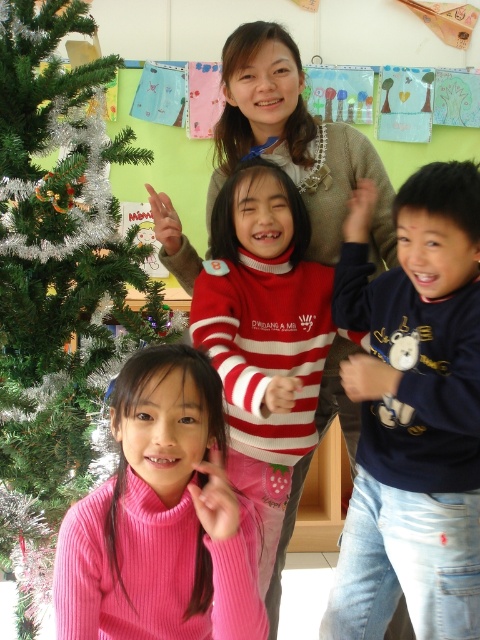
You are standing at the point labeled point (91,186) and want to move to the point labeled point (219,424). Which direction should you move to reach your destination?

To move from point (91,186) to point (219,424), you should move forward since point (91,186) is behind point (219,424).

You are a photographer setting up for a group photo in this scene. You need to ensure that both the green tinsel christmas tree at left and the pink ribbed sweater at center are clearly visible in the shot. Given their size difference, which object might require you to adjust your camera angle to avoid being too dominant in the frame?

The green tinsel christmas tree at left is larger in size than the pink ribbed sweater at center, so you might need to adjust the camera angle to prevent the tree from overshadowing the sweater in the frame.